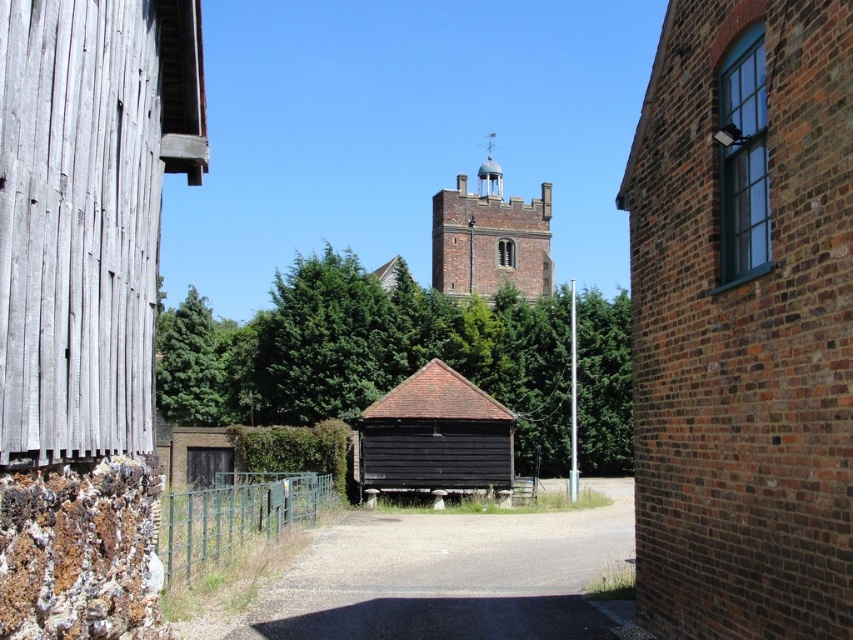
Does smooth concrete alley at center appear on the left side of dark brown wooden barn at center?

No, smooth concrete alley at center is not to the left of dark brown wooden barn at center.

Is smooth concrete alley at center wider than dark brown wooden barn at center?

Yes, smooth concrete alley at center is wider than dark brown wooden barn at center.

Measure the distance between point (x=426, y=570) and camera.

Point (x=426, y=570) is 94.09 feet from camera.

Identify the location of smooth concrete alley at center. (451, 576).

Is point (44, 291) positioned behind point (477, 365)?

No, it is in front of (477, 365).

Does point (10, 426) lie in front of point (544, 445)?

Yes, it is in front of point (544, 445).

You are a GUI agent. You are given a task and a screenshot of the screen. Output one action in this format:
    pyautogui.click(x=<x>, y=<y>)
    Task: Click on the weathered wood barn at left
    The width and height of the screenshot is (853, 640).
    Given the screenshot: What is the action you would take?
    pyautogui.click(x=85, y=301)

Who is shorter, dark brown wooden barn at center or brown brick tower at center?

With less height is dark brown wooden barn at center.

Does dark brown wooden barn at center have a lesser height compared to brown brick tower at center?

Yes.

Locate an element on the screen. This screenshot has height=640, width=853. dark brown wooden barn at center is located at coordinates (434, 436).